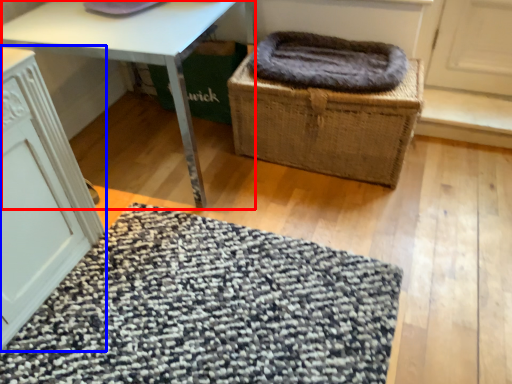
Question: Which point is closer to the camera, table (highlighted by a red box) or cabinetry (highlighted by a blue box)?

Choices:
 (A) table
 (B) cabinetry

Answer: (B)